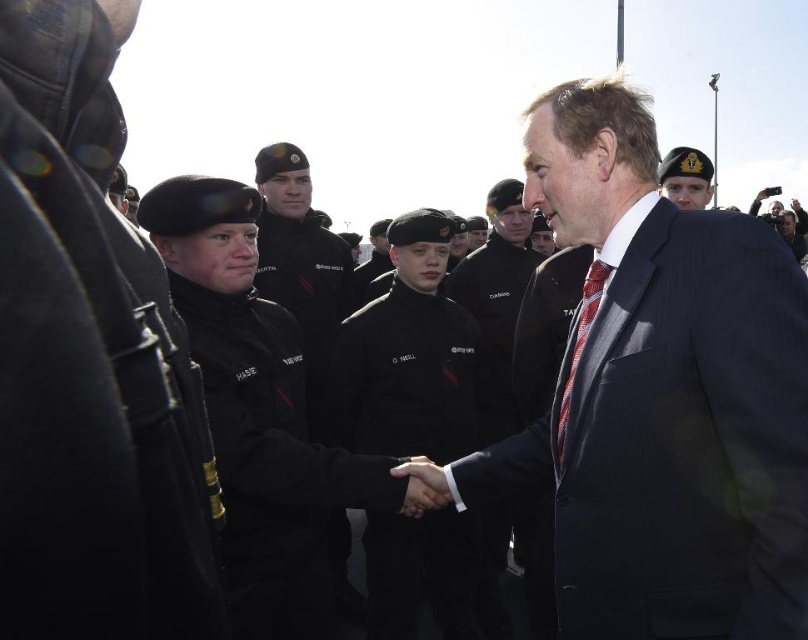
Question: Does red striped tie at right lie behind dark blue uniform at upper right?

Choices:
 (A) yes
 (B) no

Answer: (B)

Question: Which point is closer to the camera?

Choices:
 (A) dark blue suit at center
 (B) dark blue uniform at center
 (C) red striped tie at right

Answer: (A)

Question: Does red striped tie at right appear over dark blue uniform at center?

Choices:
 (A) yes
 (B) no

Answer: (B)

Question: Which of the following is the farthest from the observer?

Choices:
 (A) dark blue suit at center
 (B) dark blue uniform at center
 (C) red striped tie at right
 (D) black matte uniform at center

Answer: (B)

Question: In this image, where is dark blue suit at center located relative to black matte uniform at center?

Choices:
 (A) below
 (B) above

Answer: (B)

Question: Estimate the real-world distances between objects in this image. Which object is farther from the red striped tie at right?

Choices:
 (A) black matte uniform at center
 (B) dark blue uniform at center
 (C) dark blue suit at center

Answer: (B)